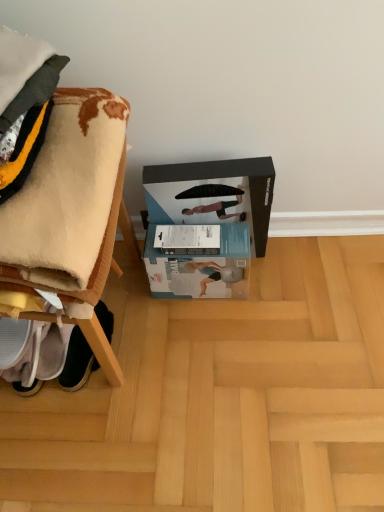
What are the coordinates of `vacant area that is in front of black matte cardboard box at center` in the screenshot? It's located at (222, 320).